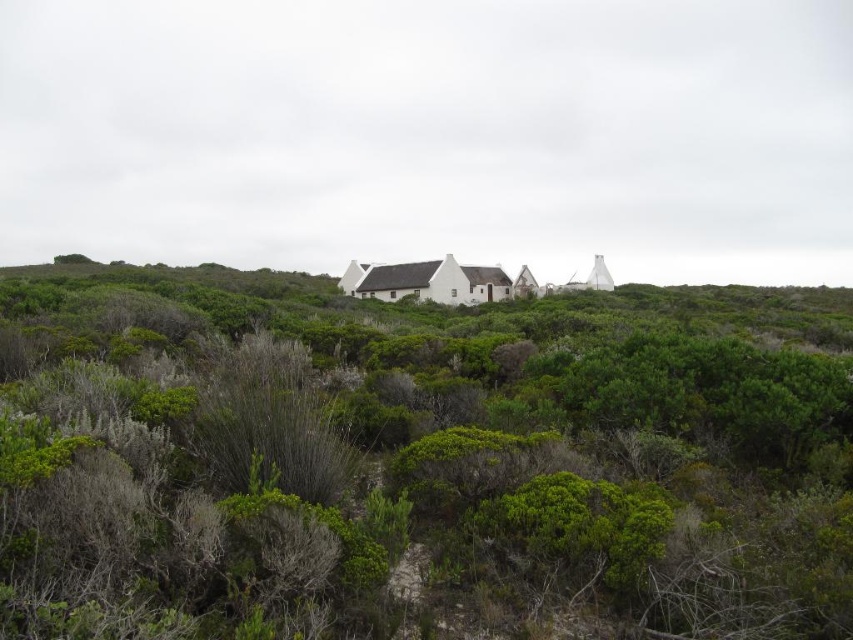
You are a drone operator tasked with capturing aerial footage of the green shrubbery at center and the white matte cottage at center. Based on the scene description, which object will appear larger in the footage?

The green shrubbery at center will appear larger in the footage because it has a larger size compared to the white matte cottage at center.

You are planning to plant a new tree in the rural landscape. The tree requires a space that is wider than the green shrubbery at center. Can the area near the white matte cottage at center accommodate this tree?

The green shrubbery at center might be wider than the white matte cottage at center, so it is uncertain if the area near the white matte cottage at center has enough space for the tree that requires a wider area than the green shrubbery at center.

You are standing in the rural landscape and want to take a photo of the green shrubbery at center and the white matte cottage at center. Which object should you focus on first if you want both to be in sharp focus?

The green shrubbery at center is closer to the viewer than the white matte cottage at center. To have both in sharp focus, focus on the white matte cottage at center since it is farther away, ensuring the depth of field includes both.